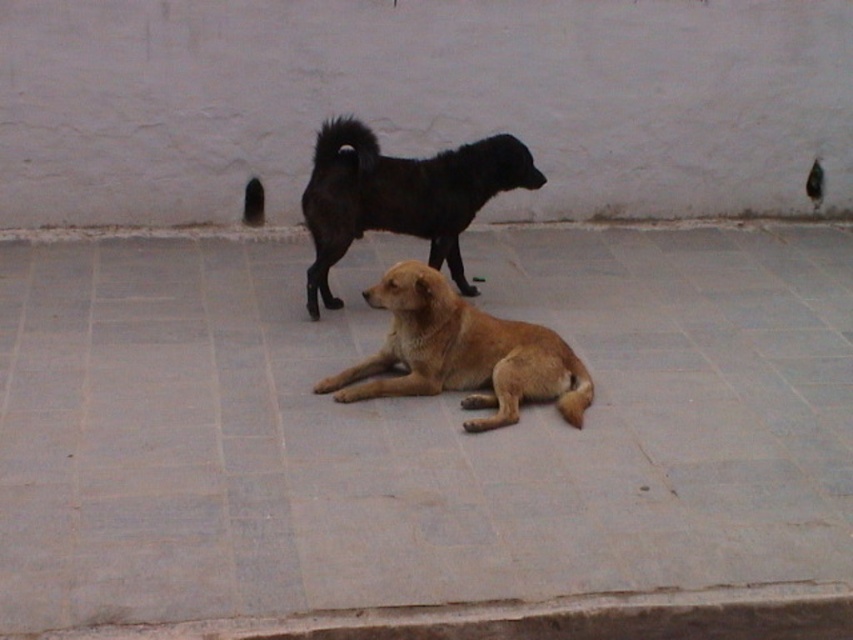
Question: Which of these objects is positioned farthest from the shiny black dog at center?

Choices:
 (A) golden fur dog at center
 (B) gray concrete pavement at center

Answer: (B)

Question: Can you confirm if golden fur dog at center is thinner than shiny black dog at center?

Choices:
 (A) no
 (B) yes

Answer: (B)

Question: Does gray concrete pavement at center appear on the left side of shiny black dog at center?

Choices:
 (A) yes
 (B) no

Answer: (B)

Question: Is golden fur dog at center smaller than shiny black dog at center?

Choices:
 (A) no
 (B) yes

Answer: (B)

Question: Which of these objects is positioned closest to the shiny black dog at center?

Choices:
 (A) gray concrete pavement at center
 (B) golden fur dog at center

Answer: (B)

Question: Estimate the real-world distances between objects in this image. Which object is farther from the golden fur dog at center?

Choices:
 (A) shiny black dog at center
 (B) gray concrete pavement at center

Answer: (A)